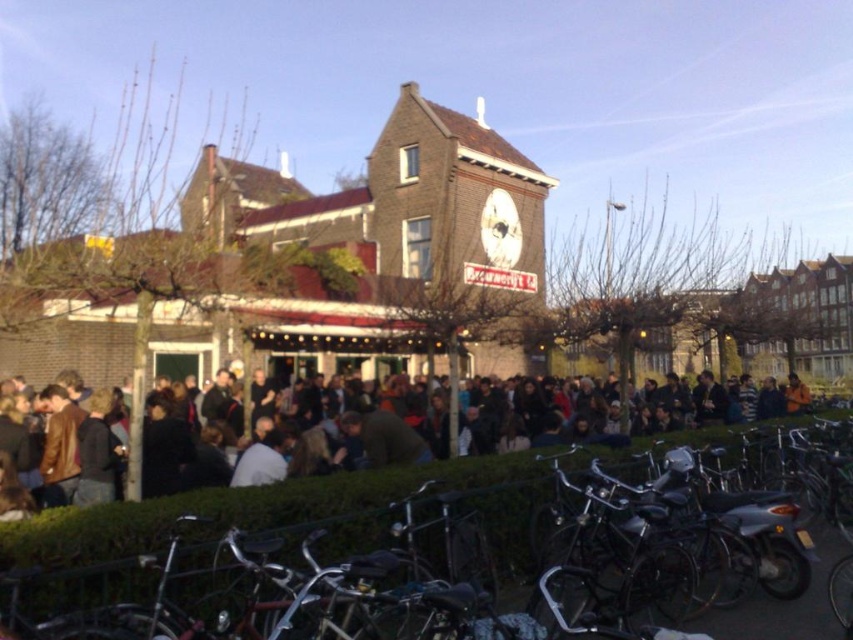
Question: Which point appears farthest from the camera in this image?

Choices:
 (A) (511, 436)
 (B) (125, 508)

Answer: (A)

Question: Can you confirm if shiny metallic bicycle at center is bigger than dark brown leather jacket at center?

Choices:
 (A) no
 (B) yes

Answer: (A)

Question: Among these objects, which one is farthest from the camera?

Choices:
 (A) dark brown leather jacket at center
 (B) shiny metallic bicycle at center

Answer: (A)

Question: Is shiny metallic bicycle at center above dark brown leather jacket at center?

Choices:
 (A) no
 (B) yes

Answer: (A)

Question: In this image, where is shiny metallic bicycle at center located relative to dark brown leather jacket at center?

Choices:
 (A) right
 (B) left

Answer: (A)